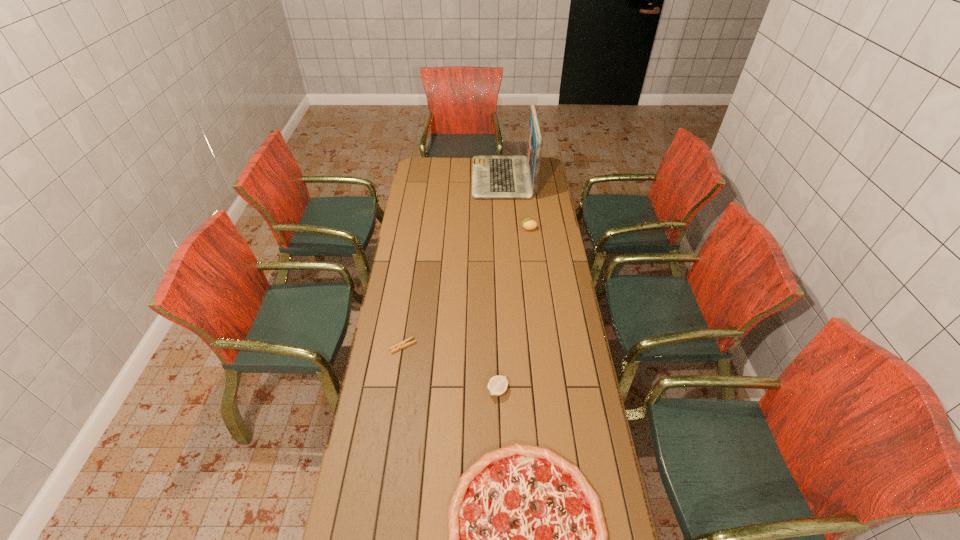
The height and width of the screenshot is (540, 960). What are the coordinates of `object at the far right corner` in the screenshot? It's located at (493, 176).

The image size is (960, 540). In the image, there is a desktop. What are the coordinates of `vacant space at the left edge` in the screenshot? It's located at (428, 248).

This screenshot has width=960, height=540. Find the location of `free space at the right edge`. free space at the right edge is located at coordinates (533, 231).

Image resolution: width=960 pixels, height=540 pixels. What are the coordinates of `free space between the shortest object and the third tallest object` in the screenshot? It's located at (450, 368).

What are the coordinates of `vacant point located between the leftmost object and the second nearest object` in the screenshot? It's located at (450, 368).

At what (x,y) coordinates should I click in order to perform the action: click on free area in between the third shortest object and the taller lemon. Please return your answer as a coordinate pair (x, y). The height and width of the screenshot is (540, 960). Looking at the image, I should click on (513, 309).

At what (x,y) coordinates should I click in order to perform the action: click on vacant space that is in between the fourth nearest object and the shortest object. Please return your answer as a coordinate pair (x, y). The height and width of the screenshot is (540, 960). Looking at the image, I should click on (466, 287).

The height and width of the screenshot is (540, 960). In order to click on unoccupied position between the farthest object and the second tallest object in this screenshot , I will do point(516,203).

What are the coordinates of `vacant space that is in between the second farthest object and the left lemon` in the screenshot? It's located at (513, 309).

Locate an element on the screen. the fourth closest object to the farthest object is located at coordinates (527, 536).